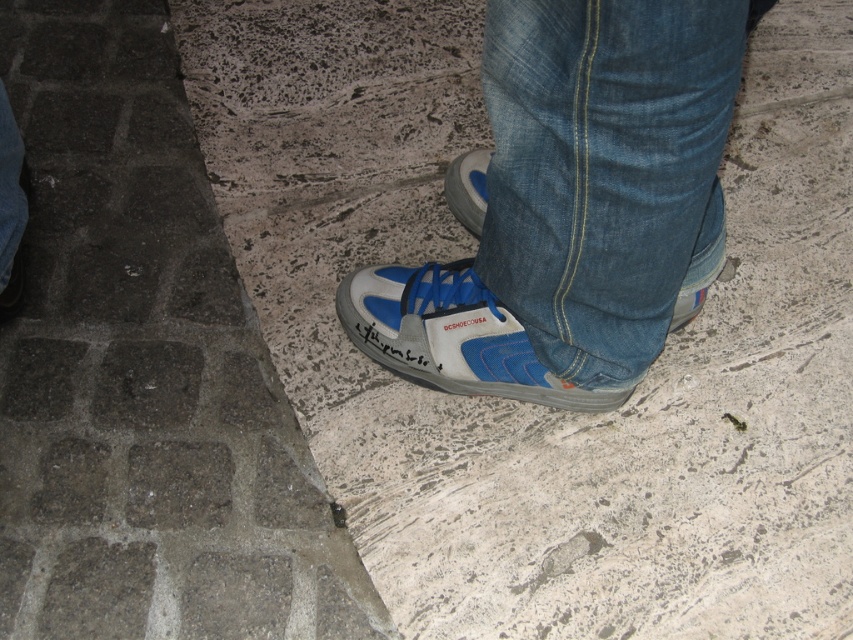
Question: Which of the following is the farthest from the observer?

Choices:
 (A) gray stone pavement at lower left
 (B) blue synthetic shoe at center
 (C) denim at center
 (D) blue synthetic shoe at lower center

Answer: (D)

Question: Which object appears farthest from the camera in this image?

Choices:
 (A) blue synthetic shoe at lower center
 (B) gray stone pavement at lower left
 (C) blue synthetic shoe at center
 (D) denim at center

Answer: (A)

Question: Is gray stone pavement at lower left bigger than denim at center?

Choices:
 (A) yes
 (B) no

Answer: (A)

Question: Can you confirm if denim at center is thinner than blue synthetic shoe at center?

Choices:
 (A) yes
 (B) no

Answer: (A)

Question: Is denim at center to the left of blue synthetic shoe at lower center from the viewer's perspective?

Choices:
 (A) yes
 (B) no

Answer: (B)

Question: Which of the following is the closest to the observer?

Choices:
 (A) denim at center
 (B) gray stone pavement at lower left
 (C) blue synthetic shoe at center

Answer: (A)